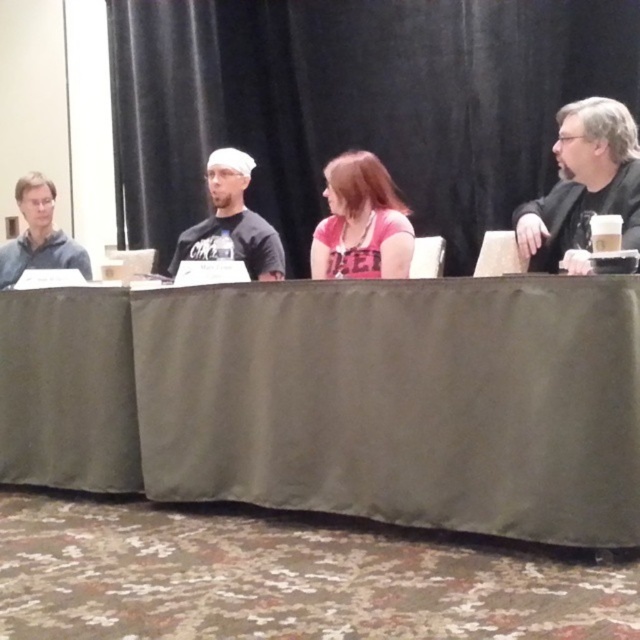
Question: Based on their relative distances, which object is farther from the matte black jacket at right?

Choices:
 (A) pink fabric shirt at center
 (B) matte gray shirt at left
 (C) green fabric table at center

Answer: (B)

Question: Is matte black jacket at right below pink fabric shirt at center?

Choices:
 (A) yes
 (B) no

Answer: (B)

Question: Is matte black jacket at right above matte black shirt at center?

Choices:
 (A) yes
 (B) no

Answer: (B)

Question: Estimate the real-world distances between objects in this image. Which object is closer to the pink fabric shirt at center?

Choices:
 (A) matte gray shirt at left
 (B) matte black jacket at right

Answer: (B)

Question: Where is matte black jacket at right located in relation to matte black shirt at center in the image?

Choices:
 (A) right
 (B) left

Answer: (A)

Question: Based on their relative distances, which object is farther from the matte gray shirt at left?

Choices:
 (A) green fabric table at center
 (B) pink fabric shirt at center
 (C) matte black jacket at right
 (D) matte black shirt at center

Answer: (C)